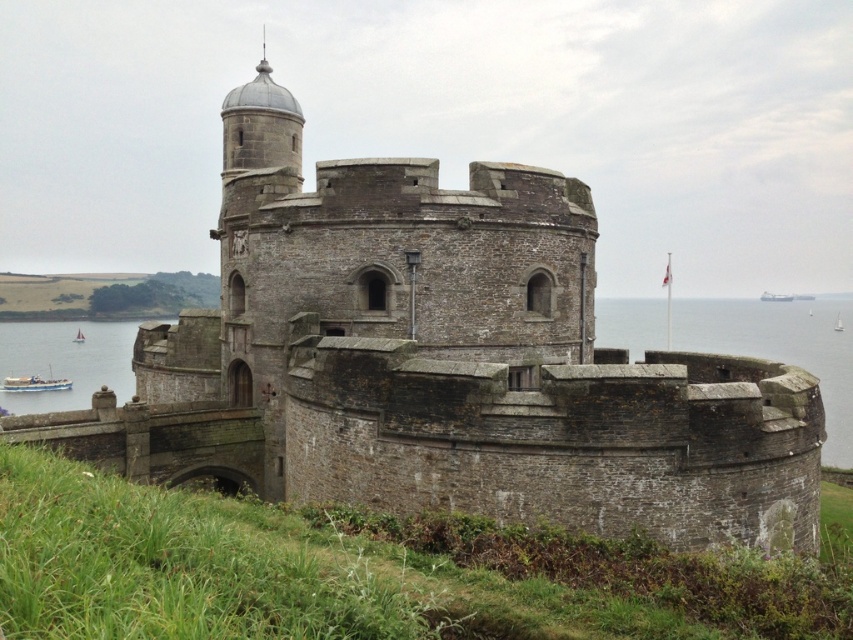
Question: Is blue water at lower left further to the viewer compared to white sailboat at lower left?

Choices:
 (A) no
 (B) yes

Answer: (A)

Question: Can you confirm if gray stone water at right is positioned to the right of white sailboat at lower left?

Choices:
 (A) no
 (B) yes

Answer: (B)

Question: Which point appears closest to the camera in this image?

Choices:
 (A) (84, 339)
 (B) (70, 346)
 (C) (705, 332)
 (D) (56, 384)

Answer: (D)

Question: Which point is closer to the camera?

Choices:
 (A) (10, 336)
 (B) (80, 340)
 (C) (9, 380)
 (D) (787, 348)

Answer: (C)

Question: Among these points, which one is farthest from the camera?

Choices:
 (A) (79, 332)
 (B) (94, 381)

Answer: (A)

Question: Is gray stone water at right closer to the viewer compared to white sailboat at lower left?

Choices:
 (A) no
 (B) yes

Answer: (B)